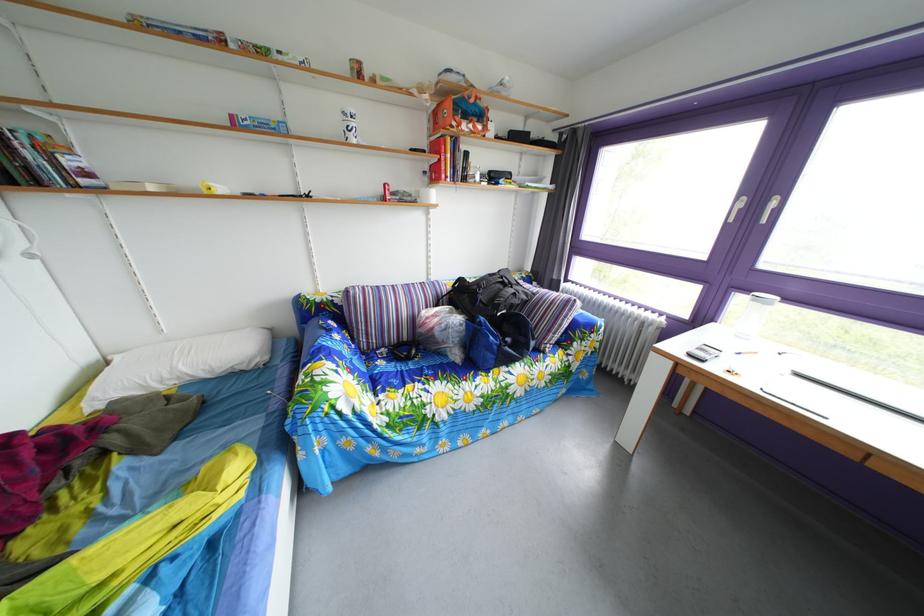
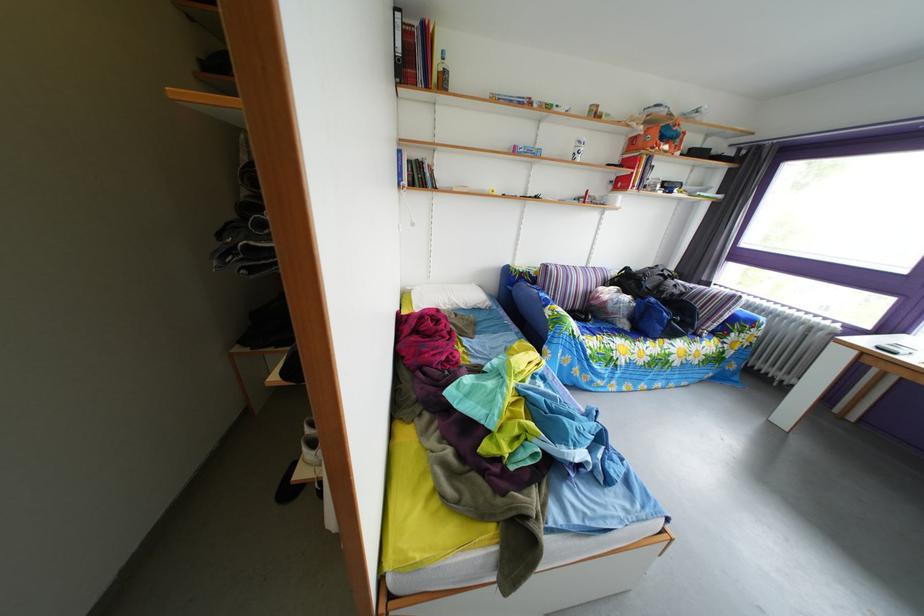
Locate, in the second image, the point that corresponds to [439,283] in the first image.

(599, 270)